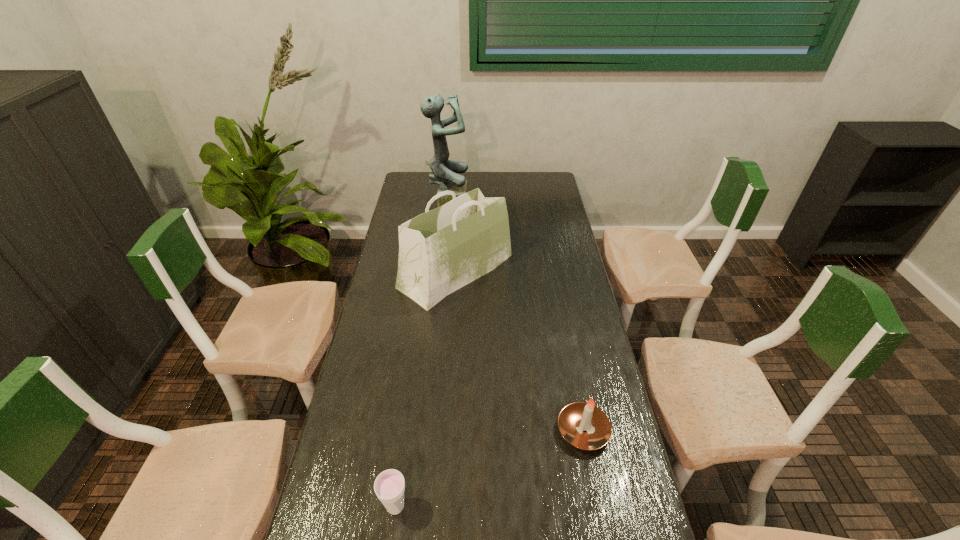
Find the location of a particular element. The width and height of the screenshot is (960, 540). vacant space at the right edge of the desktop is located at coordinates click(549, 274).

You are a GUI agent. You are given a task and a screenshot of the screen. Output one action in this format:
    pyautogui.click(x=<x>, y=<y>)
    Task: Click on the vacant point located between the sculpture and the shortest object
    
    Given the screenshot: What is the action you would take?
    pyautogui.click(x=422, y=355)

You are a GUI agent. You are given a task and a screenshot of the screen. Output one action in this format:
    pyautogui.click(x=<x>, y=<y>)
    Task: Click on the empty space that is in between the second farthest object and the nearest object
    Image resolution: width=960 pixels, height=540 pixels.
    Given the screenshot: What is the action you would take?
    pyautogui.click(x=425, y=389)

Image resolution: width=960 pixels, height=540 pixels. Find the location of `free spot between the second shortest object and the cup`. free spot between the second shortest object and the cup is located at coordinates (490, 469).

The height and width of the screenshot is (540, 960). What are the coordinates of `free space that is in between the cup and the sculpture` in the screenshot? It's located at (422, 355).

This screenshot has width=960, height=540. In order to click on vacant point located between the third tallest object and the cup in this screenshot , I will do `click(490, 469)`.

The height and width of the screenshot is (540, 960). What are the coordinates of `unoccupied position between the cup and the rightmost object` in the screenshot? It's located at (490, 469).

Locate an element on the screen. This screenshot has height=540, width=960. object that ranks as the closest to the farthest object is located at coordinates 440,251.

Locate which object is the second closest to the farthest object. Please provide its 2D coordinates. Your answer should be formatted as a tuple, i.e. [(x, y)], where the tuple contains the x and y coordinates of a point satisfying the conditions above.

[(575, 418)]

Locate an element on the screen. This screenshot has width=960, height=540. free space that satisfies the following two spatial constraints: 1. on the back side of the rightmost object; 2. on the face of the tallest object is located at coordinates (540, 204).